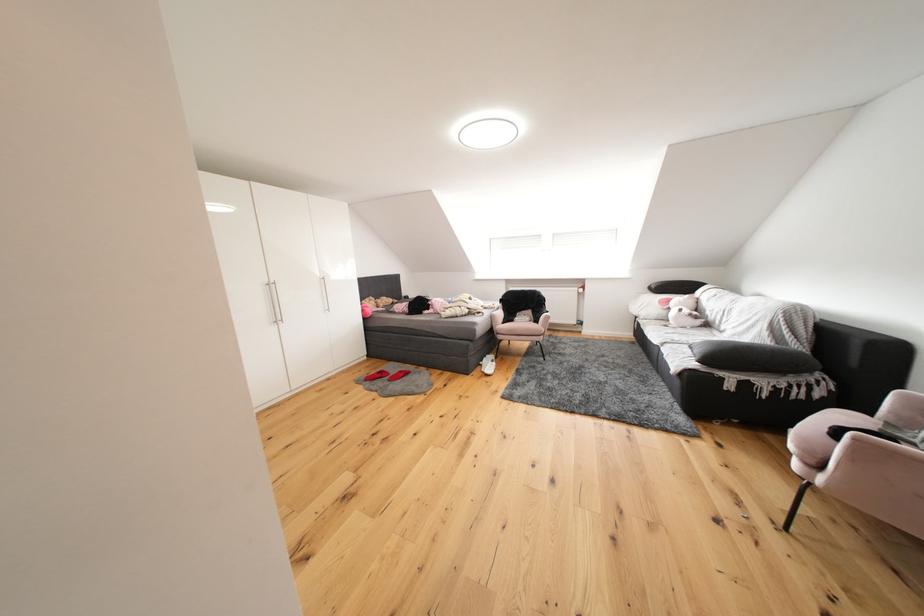
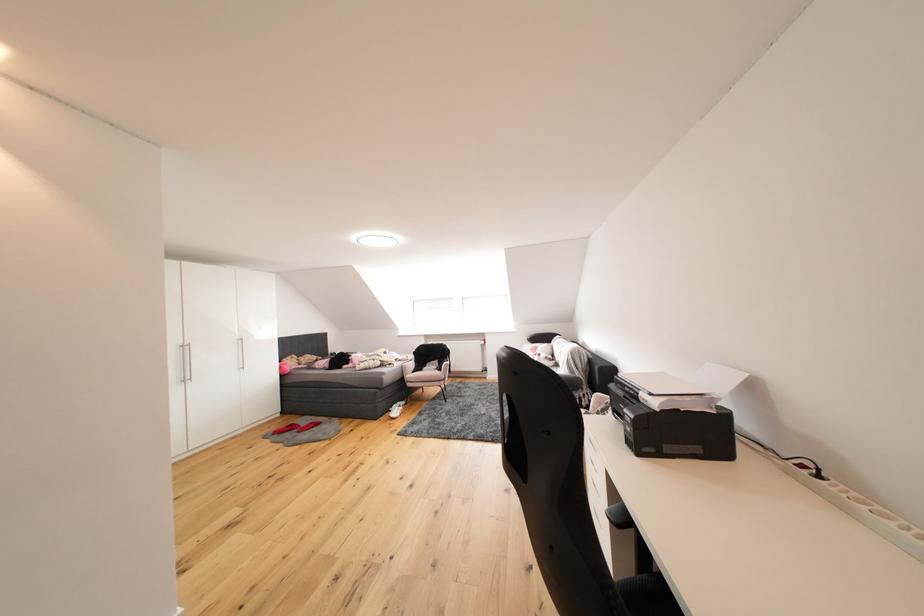
In the second image, find the point that corresponds to [511,331] in the first image.

(419, 379)